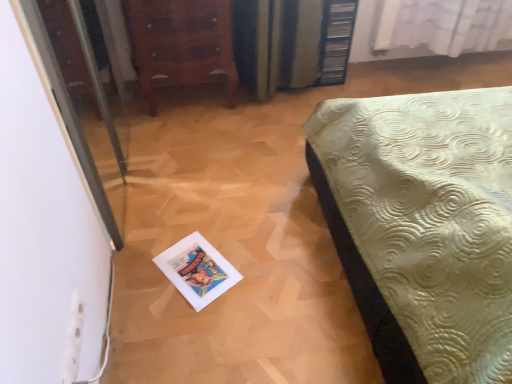
Question: Relative to white sheer curtain at upper right, is transparent glass screen door at left in front or behind?

Choices:
 (A) front
 (B) behind

Answer: (A)

Question: Based on their sizes in the image, would you say transparent glass screen door at left is bigger or smaller than white sheer curtain at upper right?

Choices:
 (A) small
 (B) big

Answer: (B)

Question: Which is farther from the wooden chest of drawers at upper left?

Choices:
 (A) white sheer curtain at upper right
 (B) transparent glass screen door at left

Answer: (A)

Question: Which is farther from the wooden chest of drawers at upper left?

Choices:
 (A) white sheer curtain at upper right
 (B) transparent glass screen door at left

Answer: (A)